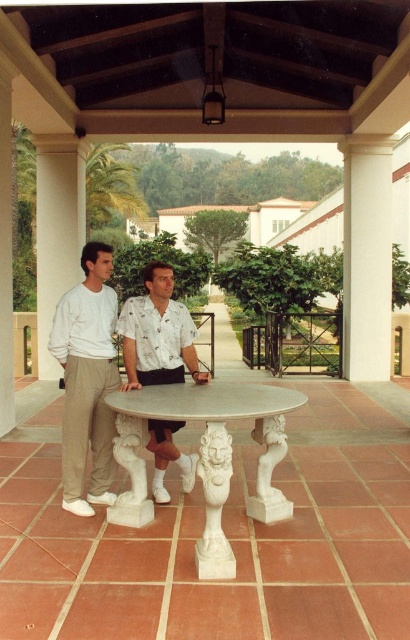
Question: Among these objects, which one is farthest from the camera?

Choices:
 (A) white marble table at center
 (B) white marble column at right
 (C) white marble lion at lower center
 (D) white marble pillar at left

Answer: (D)

Question: Which object appears farthest from the camera in this image?

Choices:
 (A) white stone lion at center
 (B) white marble lion at center
 (C) white marble table at center

Answer: (B)

Question: Does white cotton pants at center come in front of white marble lion at center?

Choices:
 (A) yes
 (B) no

Answer: (B)

Question: Is white cotton shirt at center smaller than white marble pillar at left?

Choices:
 (A) no
 (B) yes

Answer: (B)

Question: Which point is farther to the camera?

Choices:
 (A) white stone lion at center
 (B) white cotton shirt at center

Answer: (B)

Question: Is white marble pillar at left wider than white marble lion at lower center?

Choices:
 (A) no
 (B) yes

Answer: (B)